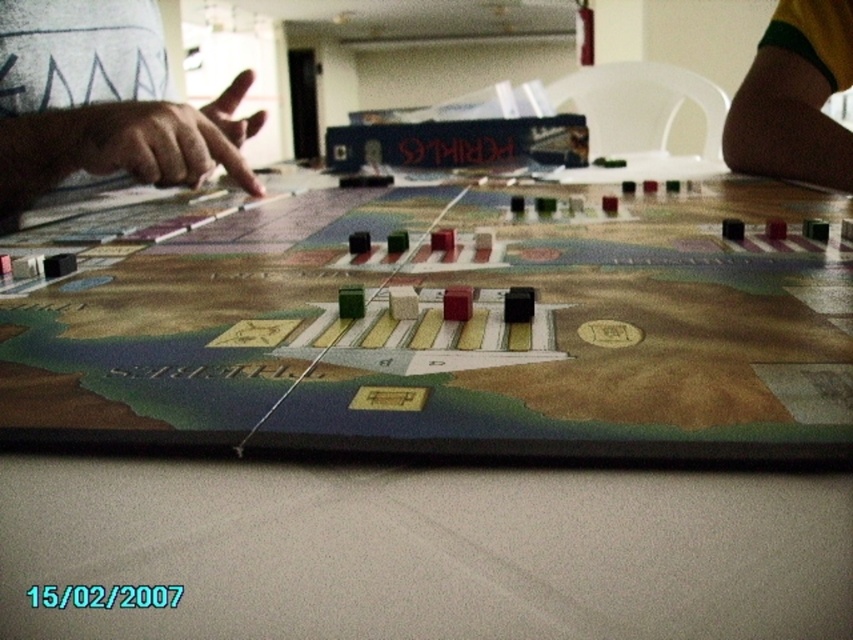
Between skinny white hand at upper left and brown fabric pants at lower right, which one is positioned lower?

skinny white hand at upper left is below.

Is point (119, 141) in front of point (782, 77)?

That is True.

Is point (56, 173) positioned behind point (764, 168)?

No, (56, 173) is in front of (764, 168).

The image size is (853, 640). I want to click on skinny white hand at upper left, so click(x=103, y=102).